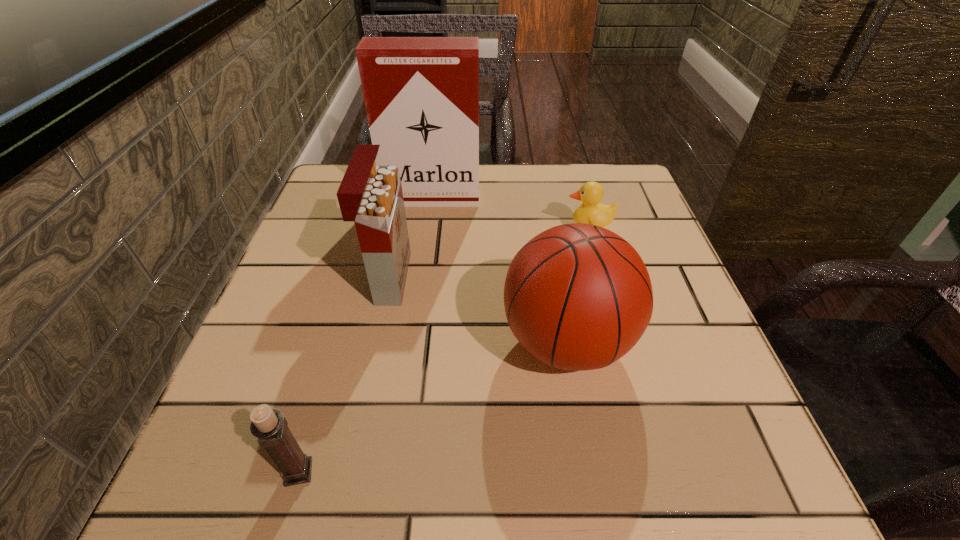
This screenshot has height=540, width=960. I want to click on free spot located on the front of the basketball, so (x=593, y=498).

Identify the location of vacant space located on the right of the nearest object. (599, 472).

You are a GUI agent. You are given a task and a screenshot of the screen. Output one action in this format:
    pyautogui.click(x=<x>, y=<y>)
    Task: Click on the free space located on the front-facing side of the fourth nearest object
    
    Given the screenshot: What is the action you would take?
    pyautogui.click(x=491, y=230)

This screenshot has width=960, height=540. Find the location of `vacant space located 0.330m on the front-facing side of the fourth nearest object`. vacant space located 0.330m on the front-facing side of the fourth nearest object is located at coordinates (413, 230).

This screenshot has width=960, height=540. I want to click on vacant area situated 0.160m on the front-facing side of the fourth nearest object, so click(x=491, y=230).

The height and width of the screenshot is (540, 960). I want to click on object that is at the far edge, so 421,94.

The width and height of the screenshot is (960, 540). In order to click on object located in the near edge section of the desktop in this screenshot , I will do `click(269, 425)`.

Identify the location of cigarette_case present at the left edge. (421, 94).

Identify the location of candle holder that is at the left edge. (269, 425).

You are a GUI agent. You are given a task and a screenshot of the screen. Output one action in this format:
    pyautogui.click(x=<x>, y=<y>)
    Task: Click on the basketball situated at the right edge
    
    Given the screenshot: What is the action you would take?
    (x=577, y=296)